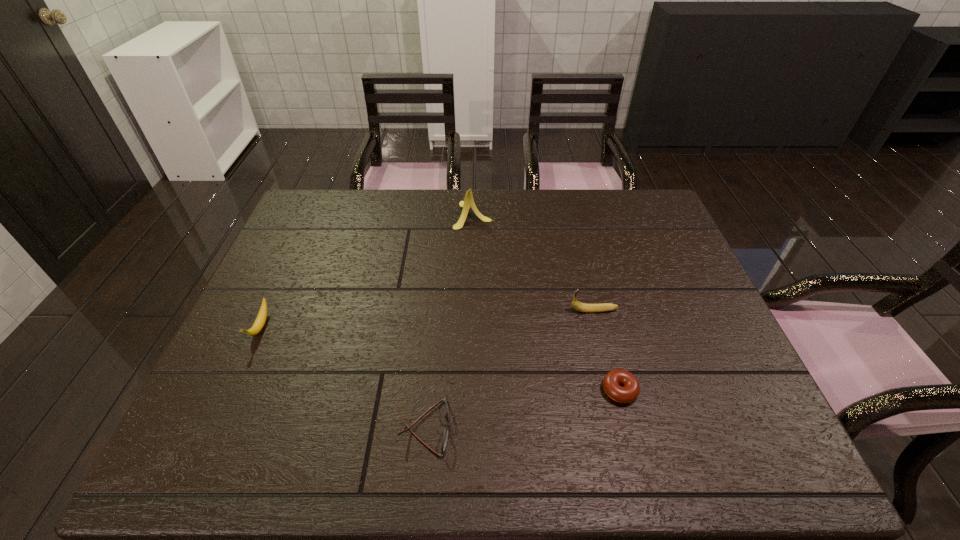
At what (x,y) coordinates should I click in order to perform the action: click on free space at the left edge. Please return your answer as a coordinate pair (x, y). Looking at the image, I should click on (267, 291).

Identify the location of blank space at the right edge of the desktop. This screenshot has width=960, height=540. (680, 299).

Identify the location of free spot at the far right corner of the desktop. (663, 213).

Identify the location of vacant area that lies between the rightmost banana and the doughnut. The width and height of the screenshot is (960, 540). (607, 350).

The height and width of the screenshot is (540, 960). Find the location of `vacant point located between the tallest object and the leftmost object`. vacant point located between the tallest object and the leftmost object is located at coordinates (367, 271).

Find the location of `vacant space that's between the fourth shortest object and the spectacles`. vacant space that's between the fourth shortest object and the spectacles is located at coordinates (509, 369).

In order to click on vacant space that is in between the third shortest object and the tallest object in this screenshot , I will do `click(367, 271)`.

You are a GUI agent. You are given a task and a screenshot of the screen. Output one action in this format:
    pyautogui.click(x=<x>, y=<y>)
    Task: Click on the free space between the spectacles and the tallest object
    The height and width of the screenshot is (540, 960).
    Given the screenshot: What is the action you would take?
    (x=448, y=321)

Where is `free space between the tallest object and the rightmost banana`? The width and height of the screenshot is (960, 540). free space between the tallest object and the rightmost banana is located at coordinates (534, 262).

The width and height of the screenshot is (960, 540). I want to click on free space between the farthest object and the leftmost object, so click(x=367, y=271).